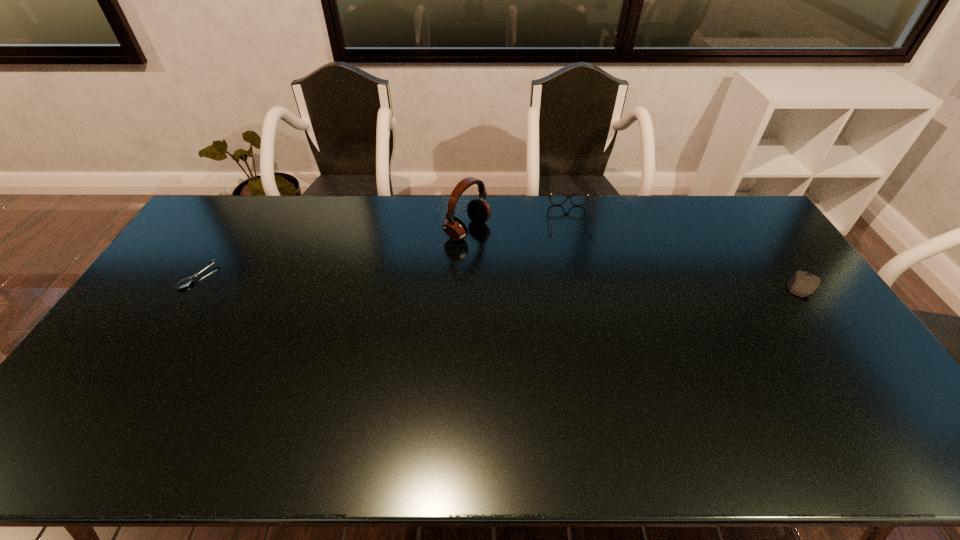
Image resolution: width=960 pixels, height=540 pixels. In order to click on empty space between the headset and the soupspoon in this screenshot , I will do `click(332, 253)`.

The height and width of the screenshot is (540, 960). Identify the location of free spot between the rightmost object and the shortest object. (499, 281).

Locate an element on the screen. The image size is (960, 540). vacant area that lies between the leftmost object and the headset is located at coordinates (332, 253).

You are a GUI agent. You are given a task and a screenshot of the screen. Output one action in this format:
    pyautogui.click(x=<x>, y=<y>)
    Task: Click on the unoccupied area between the third tallest object and the tallest object
    This screenshot has width=960, height=540.
    Given the screenshot: What is the action you would take?
    (635, 258)

This screenshot has width=960, height=540. I want to click on free space between the soupspoon and the third object from left to right, so click(x=384, y=248).

Where is `object that stands as the closest to the headset`? The height and width of the screenshot is (540, 960). object that stands as the closest to the headset is located at coordinates (568, 196).

Identify which object is the nearest to the tallest object. Please provide its 2D coordinates. Your answer should be formatted as a tuple, i.e. [(x, y)], where the tuple contains the x and y coordinates of a point satisfying the conditions above.

[(568, 196)]

Locate an element on the screen. This screenshot has width=960, height=540. free location that satisfies the following two spatial constraints: 1. on the back side of the second tallest object; 2. on the left side of the soupspoon is located at coordinates (234, 220).

The height and width of the screenshot is (540, 960). Find the location of `free space in the image that satisfies the following two spatial constraints: 1. on the front side of the rightmost object; 2. on the right side of the spectacles`. free space in the image that satisfies the following two spatial constraints: 1. on the front side of the rightmost object; 2. on the right side of the spectacles is located at coordinates (586, 286).

This screenshot has height=540, width=960. I want to click on free location that satisfies the following two spatial constraints: 1. on the back side of the third object from left to right; 2. on the right side of the leftmost object, so coord(234,220).